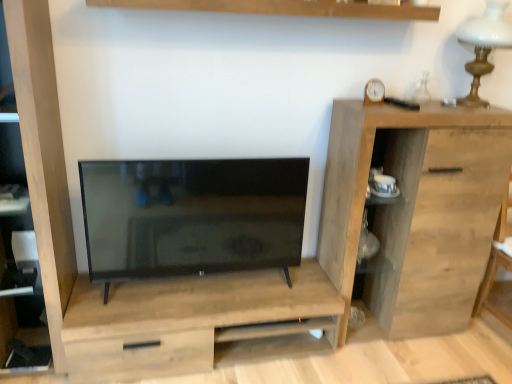
Question: From their relative heights in the image, would you say matte black tv at center is taller or shorter than light wood dresser at center?

Choices:
 (A) tall
 (B) short

Answer: (A)

Question: In terms of size, does matte black tv at center appear bigger or smaller than light wood dresser at center?

Choices:
 (A) big
 (B) small

Answer: (B)

Question: Which of these objects is positioned farthest from the white glass table lamp at upper right?

Choices:
 (A) wooden shelf at upper center
 (B) matte black tv at center
 (C) natural wood cabinet at right
 (D) wooden clock at upper right
 (E) light brown wood cabinet at left

Answer: (E)

Question: Which of these objects is positioned farthest from the wooden shelf at upper center?

Choices:
 (A) matte black tv at center
 (B) white glass table lamp at upper right
 (C) light wood dresser at center
 (D) natural wood cabinet at right
 (E) light brown wood cabinet at left

Answer: (C)